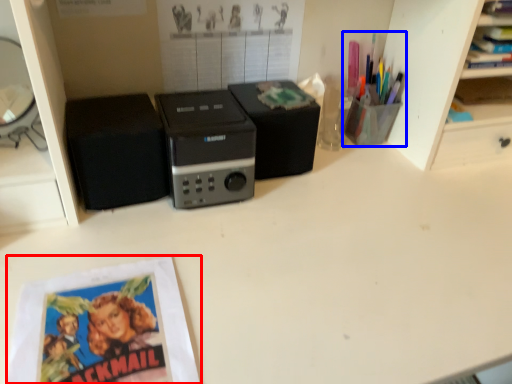
Question: Which point is further to the camera, paperback book (highlighted by a red box) or stationery (highlighted by a blue box)?

Choices:
 (A) paperback book
 (B) stationery

Answer: (B)